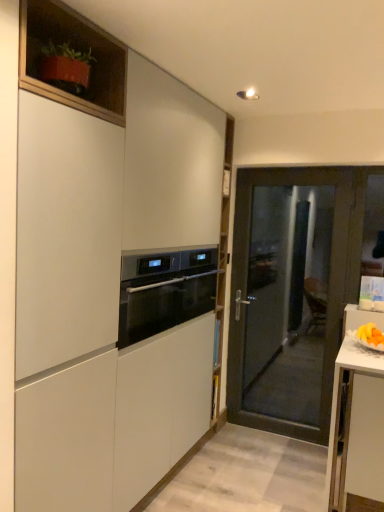
The width and height of the screenshot is (384, 512). Identify the location of empty space that is ontop of transparent glass door at center (from a real-world perspective). (300, 168).